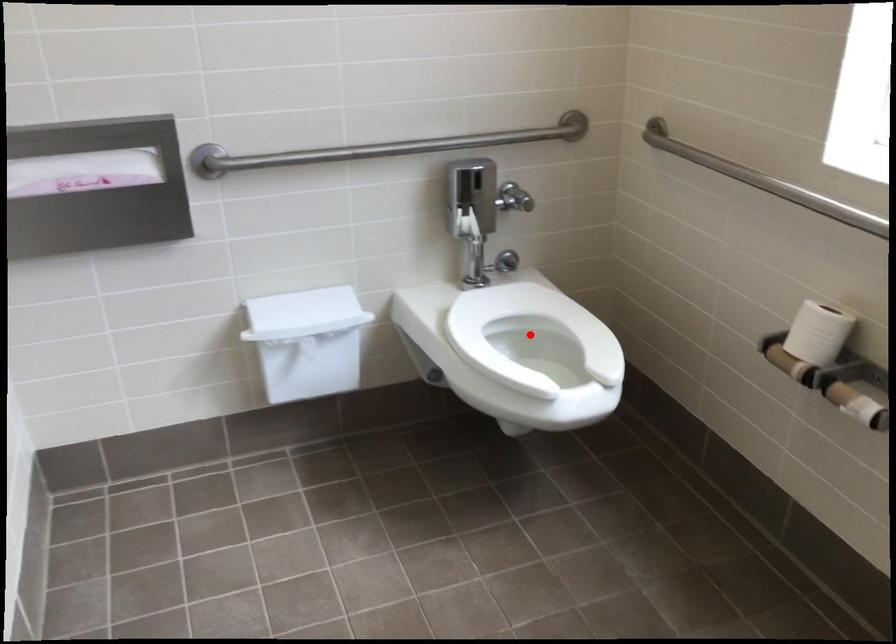
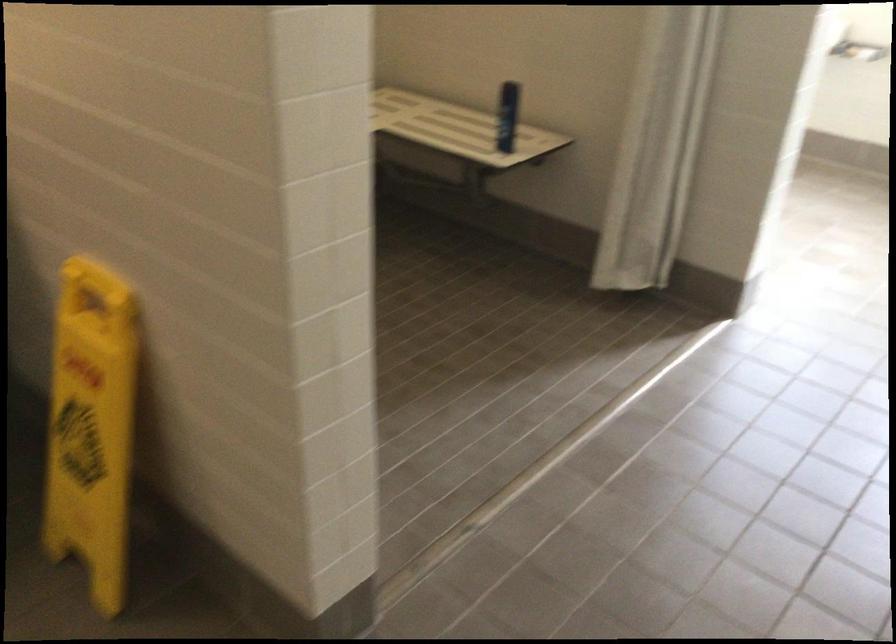
Question: I am providing you with two images of the same scene from different viewpoints. A red point is marked on the first image. At the location where the point appears in image 1, is it still visible in image 2?

Choices:
 (A) Yes
 (B) No

Answer: (B)